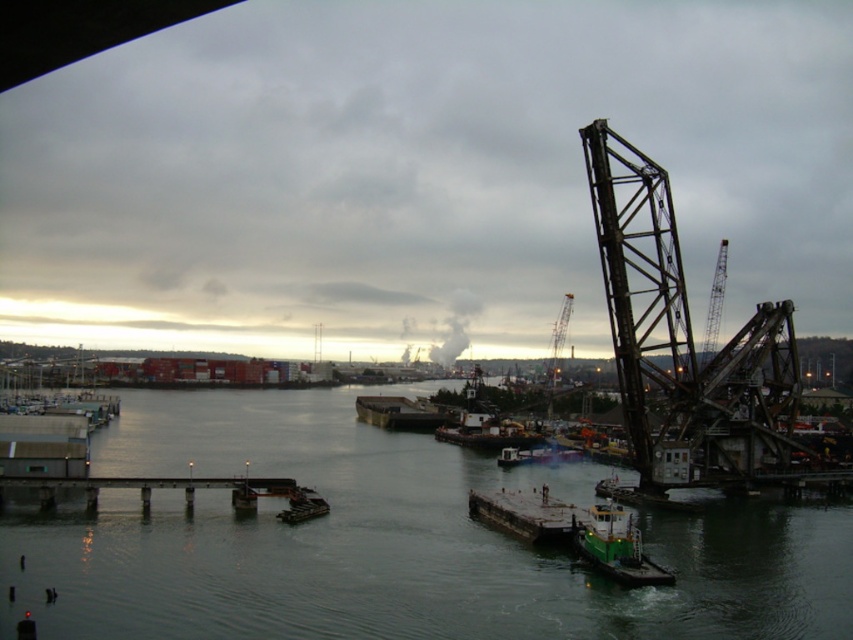
Does concrete pier at lower center lie in front of green matte tugboat at center?

That is True.

Which is behind, point (181, 480) or point (515, 429)?

Point (515, 429)

Identify the location of concrete pier at lower center. Image resolution: width=853 pixels, height=640 pixels. (158, 486).

Who is lower down, dark gray concrete dock at center or green matte tugboat at center?

dark gray concrete dock at center

Looking at this image, is dark gray concrete dock at center above green matte tugboat at center?

No, dark gray concrete dock at center is not above green matte tugboat at center.

The width and height of the screenshot is (853, 640). In order to click on dark gray concrete dock at center in this screenshot , I will do `click(527, 515)`.

Between dark gray concrete dock at center and metallic gray crane at right, which one has more height?

Standing taller between the two is metallic gray crane at right.

In the scene shown: Which is above, dark gray concrete dock at center or metallic gray crane at right?

Positioned higher is metallic gray crane at right.

Does point (550, 516) come farther from viewer compared to point (712, 296)?

No, it is in front of (712, 296).

This screenshot has height=640, width=853. What are the coordinates of `dark gray concrete dock at center` in the screenshot? It's located at (527, 515).